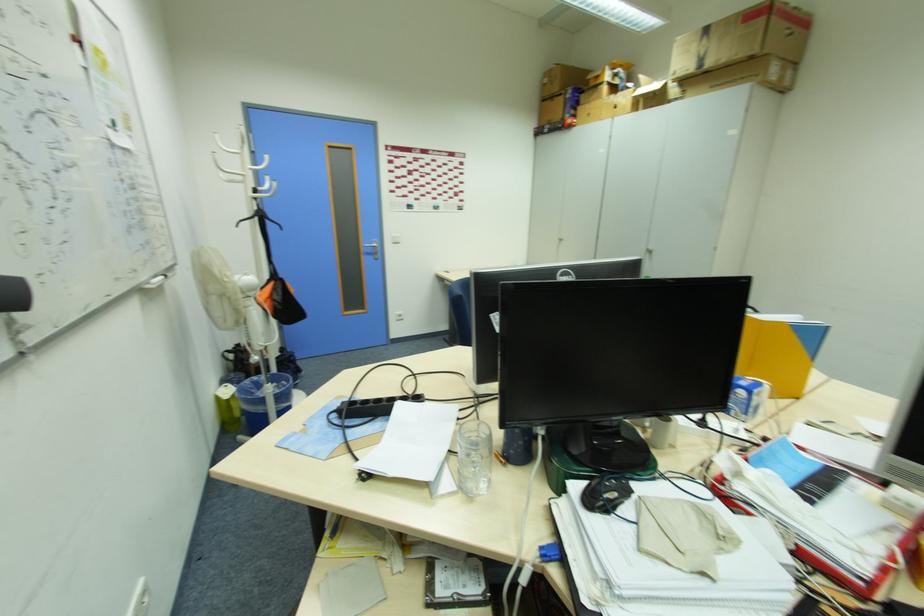
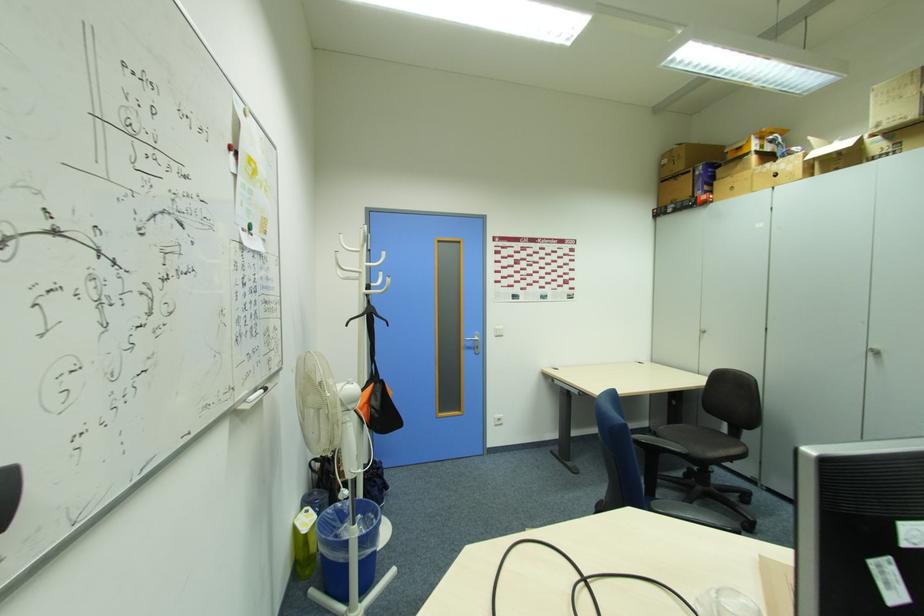
Locate, in the second image, the point that corresponds to point 371,252 in the first image.

(472, 346)